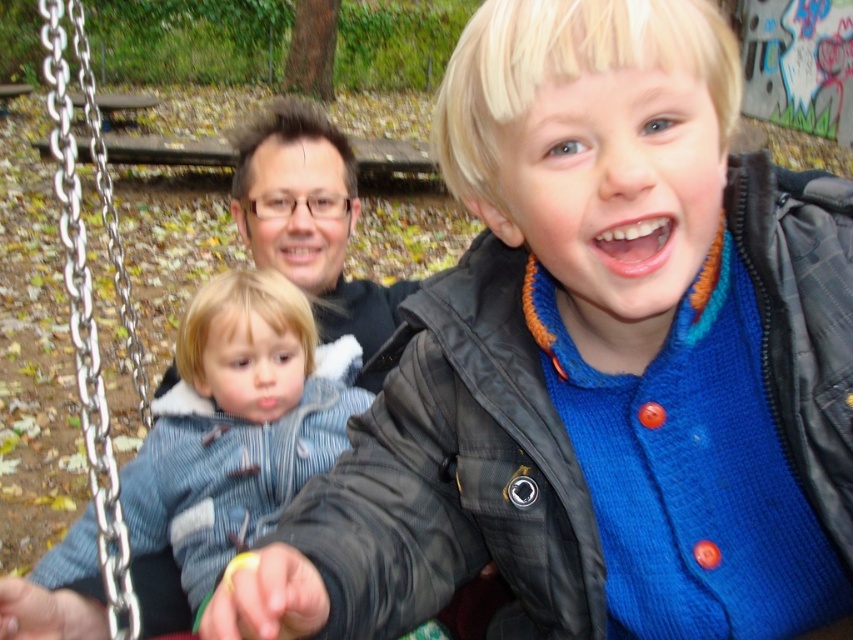
You are a photographer taking a picture of the scene. You notice the denim jacket at left and the silver metallic chain at left in the frame. Which object is positioned lower in the image?

The denim jacket at left is located below the silver metallic chain at left, so it is positioned lower in the image.

You are a photographer trying to capture the child and the adult in the scene. You notice the denim jacket at left and the silver metallic chain at left in your viewfinder. Which object should you move your camera slightly to the right to focus on?

The denim jacket at left is to the right of the silver metallic chain at left, so to focus on the denim jacket at left, you should move your camera slightly to the right from the silver metallic chain at left.

You are a photographer trying to capture a closeup of the child in the playground scene. You notice the denim jacket at left and the silver metallic chain at left in your frame. Which object should you move closer to the camera to ensure it doesn not block the child?

The denim jacket at left is shorter than the silver metallic chain at left, so moving the denim jacket at left closer to the camera would prevent it from blocking the child since it is shorter and might be closer to the camera.